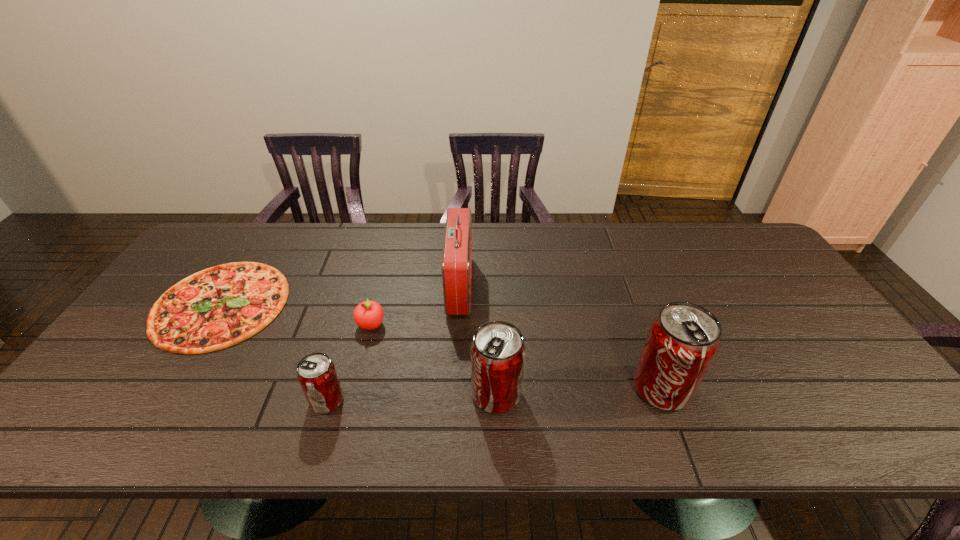
Locate an element on the screen. Image resolution: width=960 pixels, height=540 pixels. the shortest pop soda is located at coordinates pyautogui.click(x=316, y=373).

Identify the location of the leftmost pop soda. This screenshot has height=540, width=960. (316, 373).

At what (x,y) coordinates should I click in order to perform the action: click on the second object from right to left. Please return your answer as a coordinate pair (x, y). Looking at the image, I should click on (497, 351).

The image size is (960, 540). What are the coordinates of `the second pop soda from right to left` in the screenshot? It's located at (497, 351).

Locate an element on the screen. Image resolution: width=960 pixels, height=540 pixels. the rightmost pop soda is located at coordinates (683, 339).

Identify the location of the shortest object. The image size is (960, 540). (221, 306).

I want to click on the leftmost object, so click(221, 306).

Locate an element on the screen. The image size is (960, 540). the second shortest object is located at coordinates [x=368, y=315].

I want to click on the fourth object from left to right, so click(x=457, y=250).

You are a GUI agent. You are given a task and a screenshot of the screen. Output one action in this format:
    pyautogui.click(x=<x>, y=<y>)
    Task: Click on the vacant region located on the back of the shortest pop soda
    
    Given the screenshot: What is the action you would take?
    pyautogui.click(x=340, y=360)